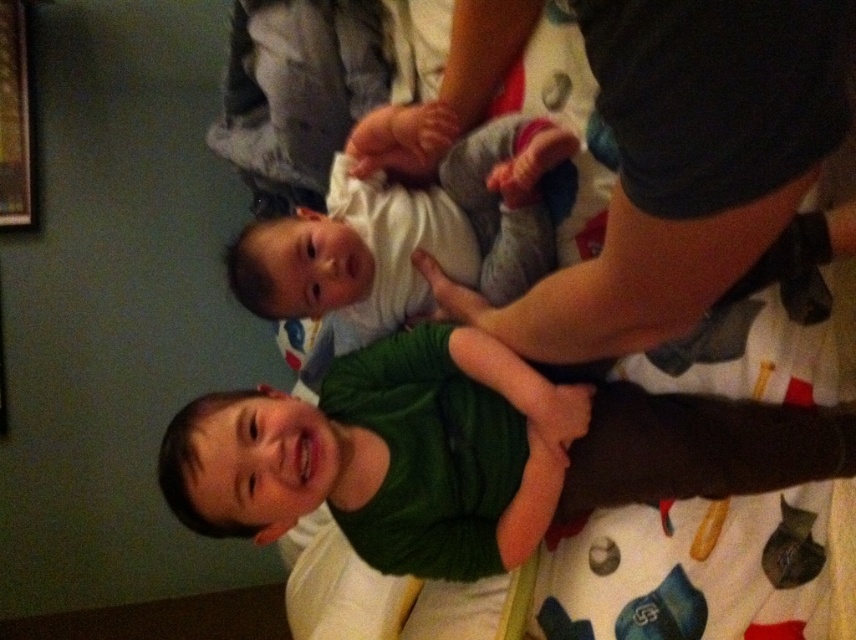
Who is more distant from viewer, [544,380] or [419,200]?

Positioned behind is point [419,200].

Is point (248, 410) behind point (444, 188)?

That is False.

Is point (397, 436) more distant than point (348, 184)?

That is False.

The width and height of the screenshot is (856, 640). What are the coordinates of `green matte shirt at center` in the screenshot? It's located at (468, 454).